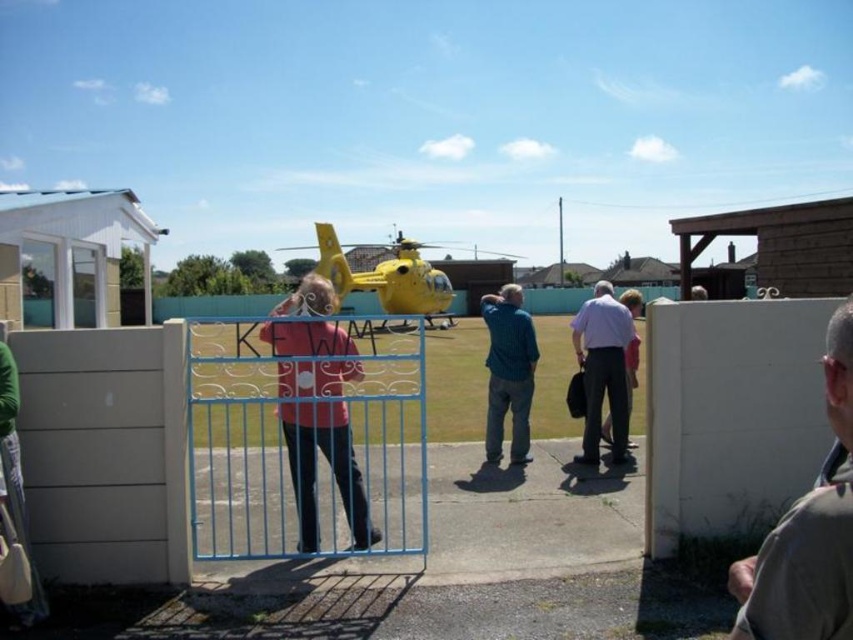
Between blue metal gate at center and gray fabric shirt at right, which one appears on the right side from the viewer's perspective?

Positioned to the right is gray fabric shirt at right.

Between blue metal gate at center and gray fabric shirt at right, which one appears on the left side from the viewer's perspective?

blue metal gate at center

Which is in front, point (207, 403) or point (834, 419)?

Point (834, 419) is more forward.

Identify the location of blue metal gate at center. The image size is (853, 640). (294, 436).

Where is `blue metal gate at center`? The height and width of the screenshot is (640, 853). blue metal gate at center is located at coordinates (294, 436).

Is point (201, 388) less distant than point (589, 339)?

No, it is not.

Where is `blue metal gate at center`? The width and height of the screenshot is (853, 640). blue metal gate at center is located at coordinates (294, 436).

Where is `blue metal gate at center`? The image size is (853, 640). blue metal gate at center is located at coordinates (294, 436).

Who is positioned more to the right, light purple shirt at center or blue textured shirt at center?

From the viewer's perspective, blue textured shirt at center appears more on the right side.

Is the position of light purple shirt at center less distant than that of blue textured shirt at center?

No.

Which is in front, point (630, 337) or point (488, 413)?

Point (630, 337) is more forward.

This screenshot has width=853, height=640. Identify the location of light purple shirt at center. (602, 369).